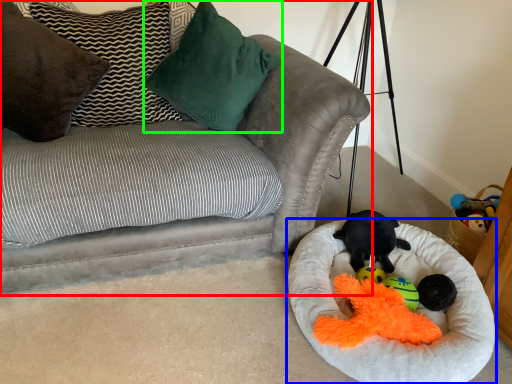
Question: Which object is positioned closest to studio couch (highlighted by a red box)? Select from dog bed (highlighted by a blue box) and pillow (highlighted by a green box).

Choices:
 (A) dog bed
 (B) pillow

Answer: (B)